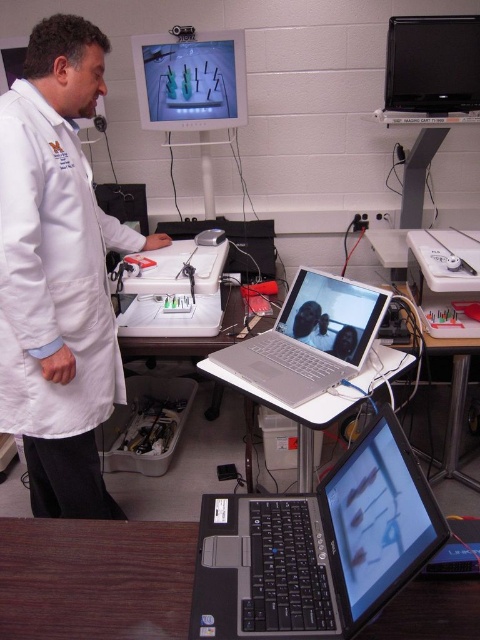
Question: Considering the real-world distances, which object is farthest from the white lab coat at center?

Choices:
 (A) black matte laptop at lower center
 (B) wooden table at lower left

Answer: (A)

Question: Which is nearer to the black matte laptop at lower center?

Choices:
 (A) white lab coat at center
 (B) wooden table at lower left
 (C) silver metallic laptop at center

Answer: (B)

Question: In this image, where is black matte laptop at lower center located relative to silver metallic laptop at center?

Choices:
 (A) left
 (B) right

Answer: (A)

Question: Which object appears closest to the camera in this image?

Choices:
 (A) wooden table at lower left
 (B) black matte laptop at lower center
 (C) white lab coat at center

Answer: (B)

Question: Can you confirm if white lab coat at center is wider than black matte laptop at lower center?

Choices:
 (A) yes
 (B) no

Answer: (A)

Question: In this image, where is black matte laptop at lower center located relative to silver metallic laptop at center?

Choices:
 (A) right
 (B) left

Answer: (B)